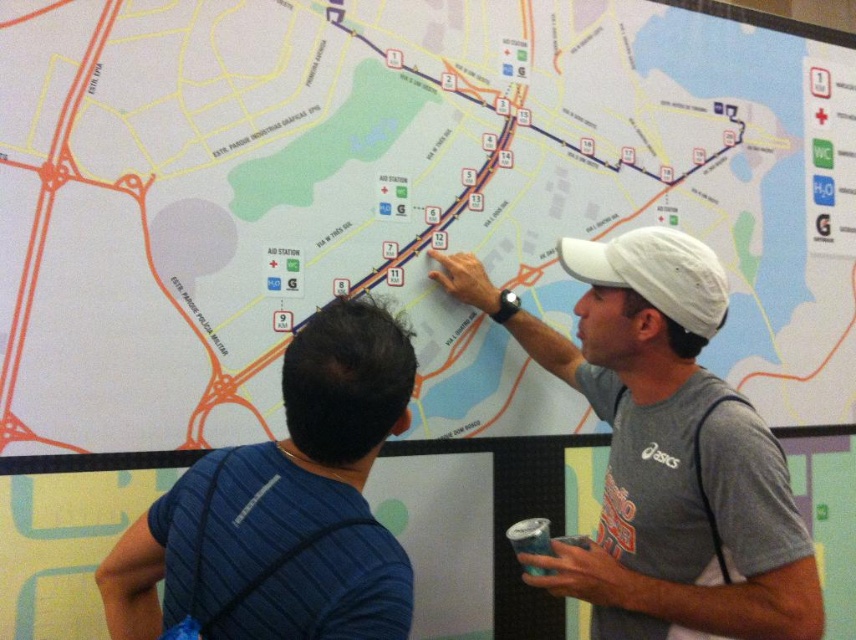
Question: Is white matte map at center wider than blue striped shirt at upper left?

Choices:
 (A) yes
 (B) no

Answer: (A)

Question: Estimate the real-world distances between objects in this image. Which object is closer to the white matte map at center?

Choices:
 (A) gray cotton t-shirt at upper right
 (B) white matte baseball cap at upper right

Answer: (A)

Question: Which is farther from the white matte map at center?

Choices:
 (A) blue striped shirt at upper left
 (B) white matte baseball cap at upper right

Answer: (A)

Question: Which object is positioned farthest from the white matte map at center?

Choices:
 (A) gray cotton t-shirt at upper right
 (B) white matte baseball cap at upper right

Answer: (B)

Question: Is blue striped shirt at upper left to the right of white matte baseball cap at upper right from the viewer's perspective?

Choices:
 (A) no
 (B) yes

Answer: (A)

Question: Can you confirm if white matte map at center is positioned below blue striped shirt at upper left?

Choices:
 (A) yes
 (B) no

Answer: (B)